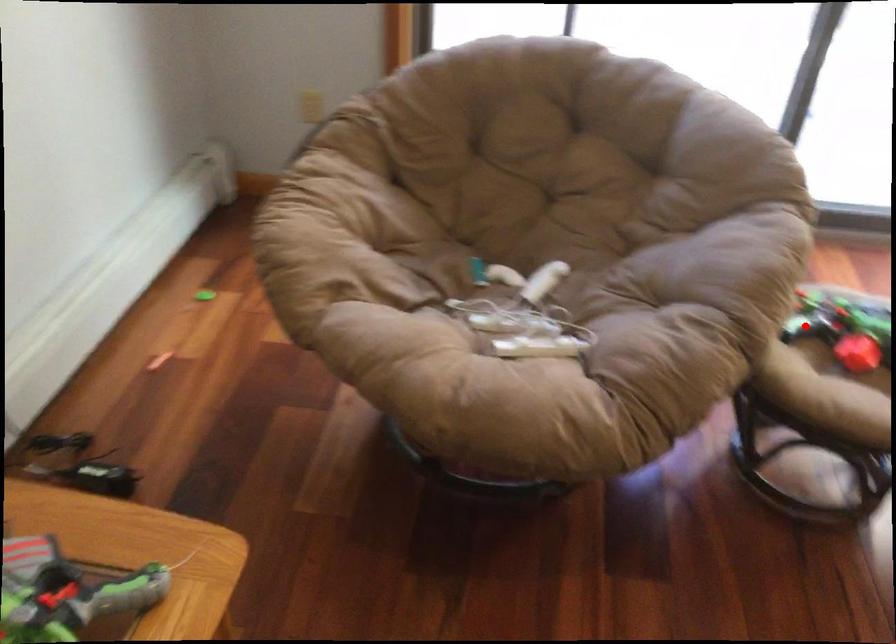
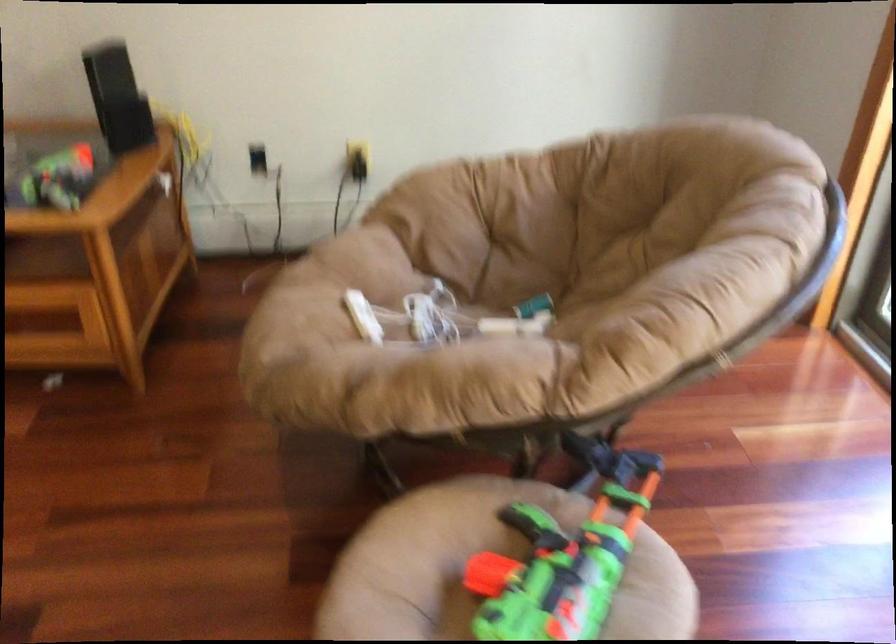
In the second image, find the point that corresponds to the highlighted location in the first image.

(530, 520)